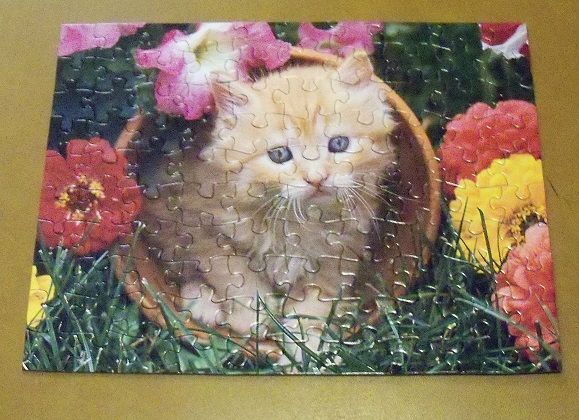
This screenshot has height=420, width=579. In order to click on corner piece in this screenshot , I will do `click(28, 358)`, `click(549, 363)`, `click(518, 35)`, `click(75, 33)`.